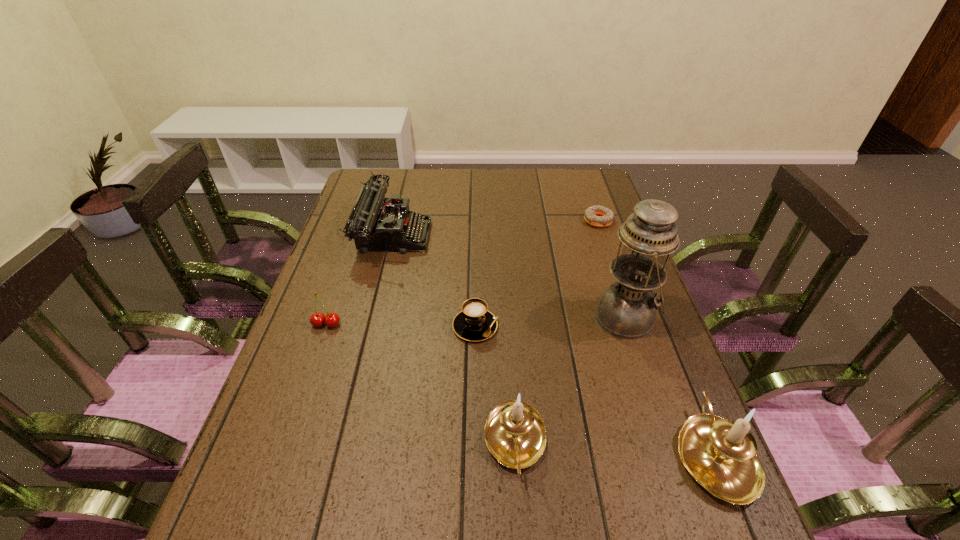
This screenshot has width=960, height=540. In order to click on free point between the shorter candle holder and the taller candle holder in this screenshot , I will do `click(615, 448)`.

Image resolution: width=960 pixels, height=540 pixels. Find the location of `empty space between the sixth shortest object and the left candle holder`. empty space between the sixth shortest object and the left candle holder is located at coordinates (615, 448).

The height and width of the screenshot is (540, 960). I want to click on empty space that is in between the oil lamp and the second shortest object, so click(551, 322).

I want to click on free space between the left candle holder and the doughnut, so click(557, 331).

Locate an element on the screen. The image size is (960, 540). empty space between the doughnut and the taller candle holder is located at coordinates (657, 337).

The width and height of the screenshot is (960, 540). In order to click on free spot between the doughnut and the shorter candle holder in this screenshot , I will do `click(557, 331)`.

Where is `vacant space in between the oil lamp and the cappuccino`? vacant space in between the oil lamp and the cappuccino is located at coordinates (551, 322).

Where is `vacant area that lies between the cherry and the doughnut`? vacant area that lies between the cherry and the doughnut is located at coordinates (463, 273).

Locate which object ranks fifth in proximity to the right candle holder. Please provide its 2D coordinates. Your answer should be formatted as a tuple, i.e. [(x, y)], where the tuple contains the x and y coordinates of a point satisfying the conditions above.

[(372, 224)]

At what (x,y) coordinates should I click in order to perform the action: click on object that can be found as the third closest to the typewriter. Please return your answer as a coordinate pair (x, y). Looking at the image, I should click on (627, 309).